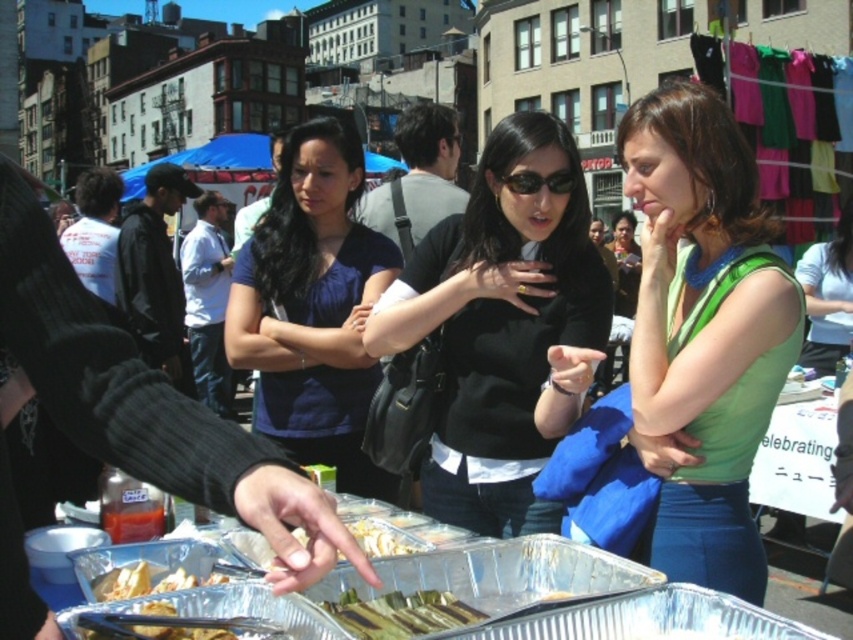
You are standing at the viewpoint of the image and want to determine which of the two points, point (646, 417) or point (842, 330), is nearer to you. Based on the scene, which point is closer?

Point (646, 417) is closer to the camera than point (842, 330), so it is the nearer one.

You are organizing a community event and need to ensure all volunteers are visible from a distance. The black matte shirt at center and the matte blue shirt at center are two volunteer uniform options. Based on the image, which shirt would be more noticeable to attendees due to its size?

The black matte shirt at center would be more noticeable to attendees because its width surpasses that of the matte blue shirt at center, making it larger and thus more visible from a distance.